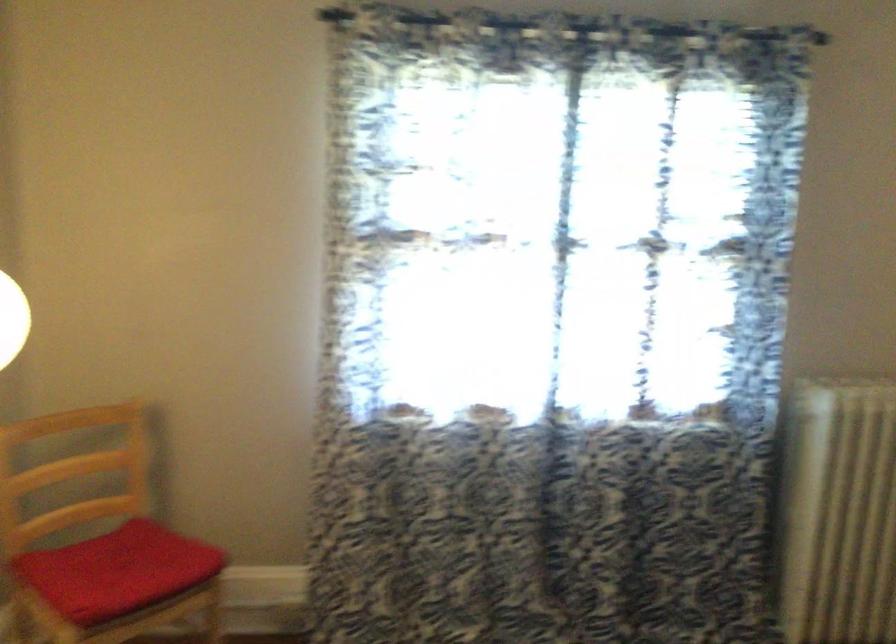
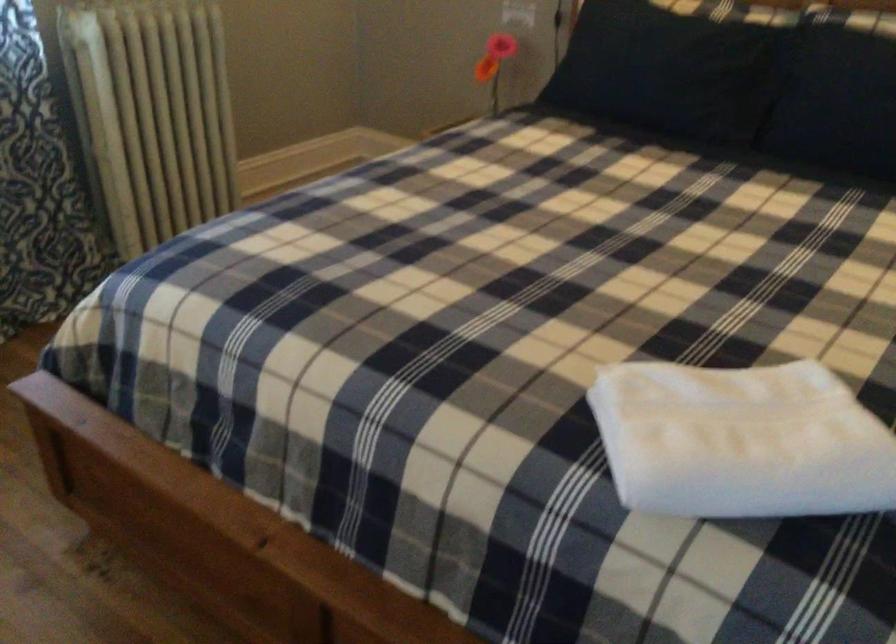
The images are taken continuously from a first-person perspective. In which direction is your viewpoint rotating?

The camera's rotation is toward right-down.